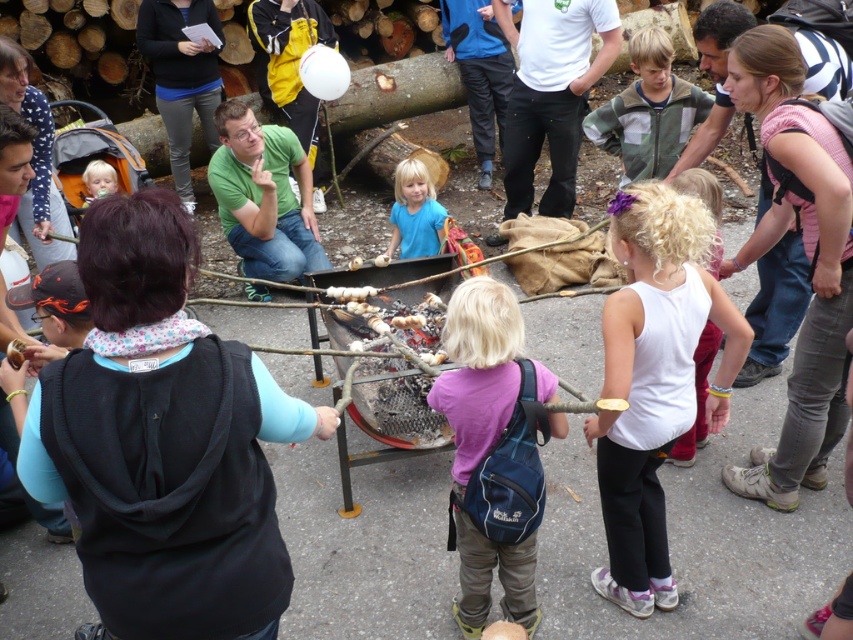
You are a photographer trying to capture a candid shot of the white cotton shirt at center and the light blue fabric at center. Since you want to ensure both subjects are in focus, you need to know which one is wider. Which one has a greater width?

The white cotton shirt at center has a greater width than the light blue fabric at center.

Based on the photo, you are a photographer trying to capture a clear shot of both the purple fabric backpack at center and the green fleece jacket at center. Since you want both items to be in focus, which one should you focus on first to ensure the other remains sharp in the photo?

You should focus on the purple fabric backpack at center first because it is closer to the viewer than the green fleece jacket at center. By focusing on the closer object, the farther one will still be within the depth of field, ensuring both are sharp.